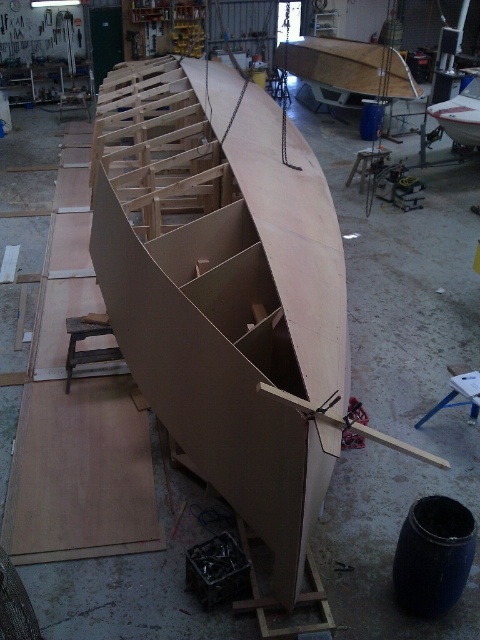
You are standing in the workshop and need to place a new tool on the floor. The tool requires a clear space that is not under the light brown wood boat at center. Where should you place it?

Since the light brown wood boat at center is positioned at coordinates approximately 0.466 on the x and 0.477 on the y axis, placing the tool anywhere outside these coordinates would ensure it is not under the boat.

You are standing in the workshop and want to move from the point at coordinates point (254, 428) to the point at coordinates point (454, 124). Which direction should you move to get closer to your destination?

To move from point (254, 428) to point (454, 124), you should move towards the upper left direction since point (454, 124) is located in that direction relative to point (254, 428).